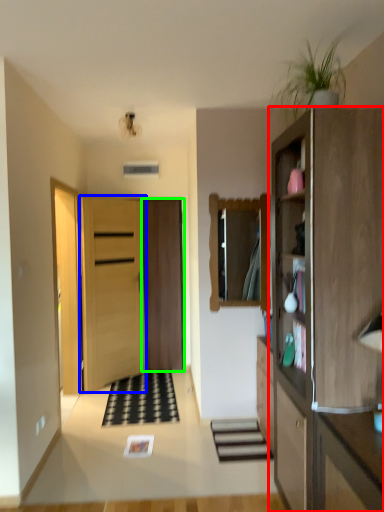
Question: Based on their relative distances, which object is farther from cabinetry (highlighted by a red box)? Choose from door (highlighted by a blue box) and door (highlighted by a green box).

Choices:
 (A) door
 (B) door

Answer: (B)